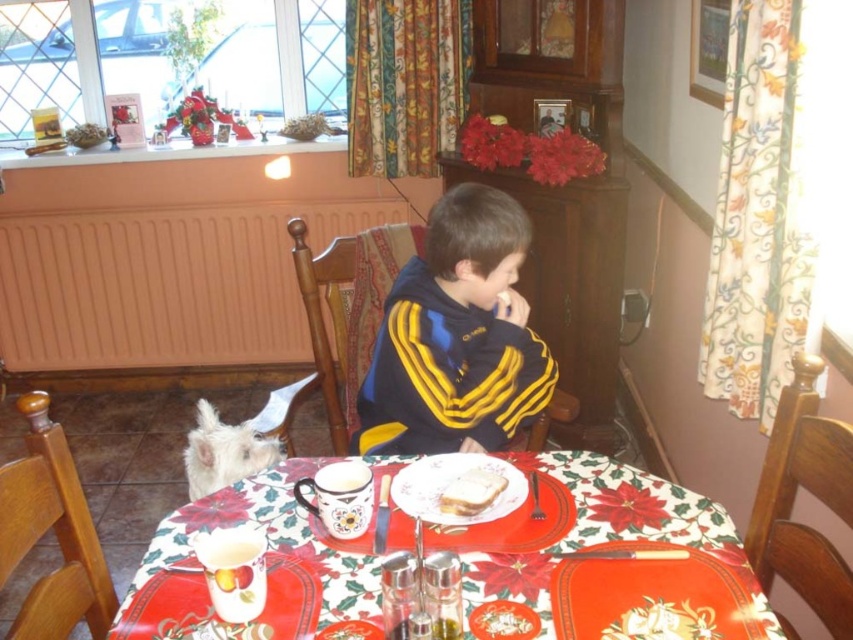
Does point (387, 432) lie in front of point (415, 502)?

That is False.

Between black/yellow striped sweater at center and white ceramic plate at center, which one is positioned higher?

Positioned higher is black/yellow striped sweater at center.

Find the location of a particular element. This screenshot has height=640, width=853. black/yellow striped sweater at center is located at coordinates (456, 337).

Who is more distant from viewer, (589,486) or (393,410)?

Point (393,410)

Does point (212, 605) lie in front of point (473, 196)?

That is True.

This screenshot has width=853, height=640. Identify the location of white glossy plate at center. (628, 561).

Can you confirm if white fur dog at lower left is wider than white bread at center?

Yes, white fur dog at lower left is wider than white bread at center.

The width and height of the screenshot is (853, 640). What do you see at coordinates (224, 452) in the screenshot?
I see `white fur dog at lower left` at bounding box center [224, 452].

In order to click on white fur dog at lower left in this screenshot , I will do pos(224,452).

At what (x,y) coordinates should I click in order to perform the action: click on white fur dog at lower left. Please return your answer as a coordinate pair (x, y). Image resolution: width=853 pixels, height=640 pixels. Looking at the image, I should click on (224, 452).